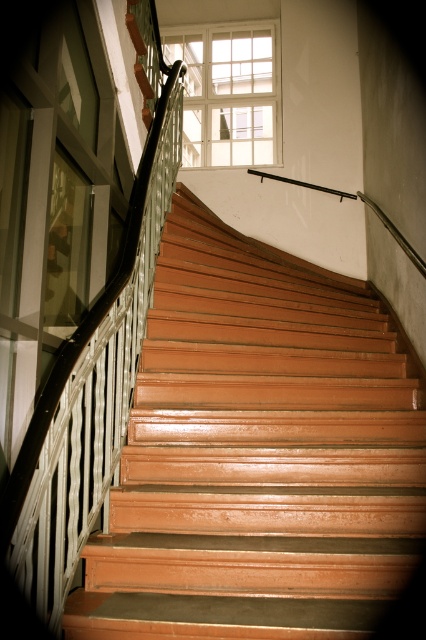
Who is more distant from viewer, (140, 397) or (258, 112)?

Point (258, 112)

In the scene shown: Measure the distance between peach glossy stairs at center and clear glass window at upper center.

The distance of peach glossy stairs at center from clear glass window at upper center is 3.72 meters.

Locate an element on the screen. Image resolution: width=426 pixels, height=640 pixels. peach glossy stairs at center is located at coordinates (258, 452).